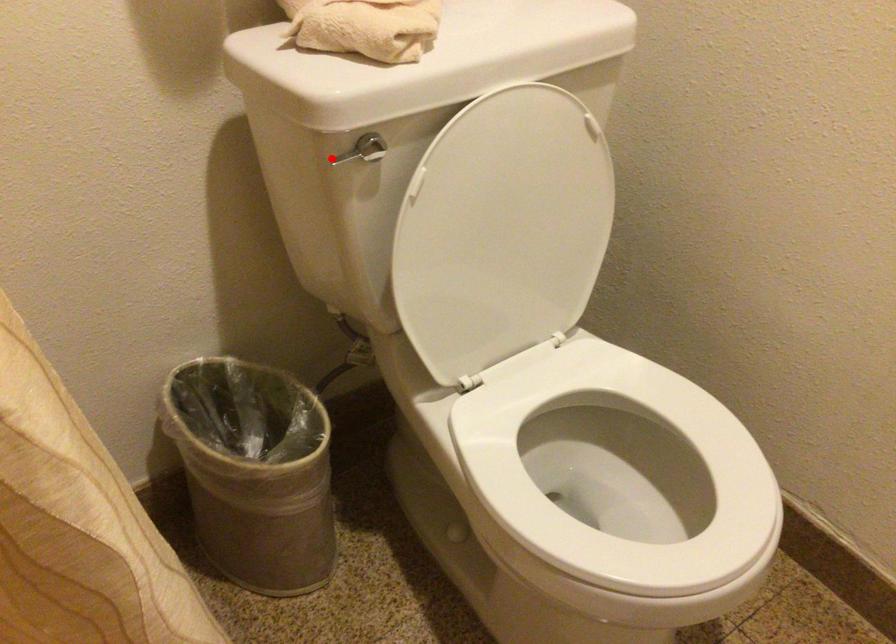
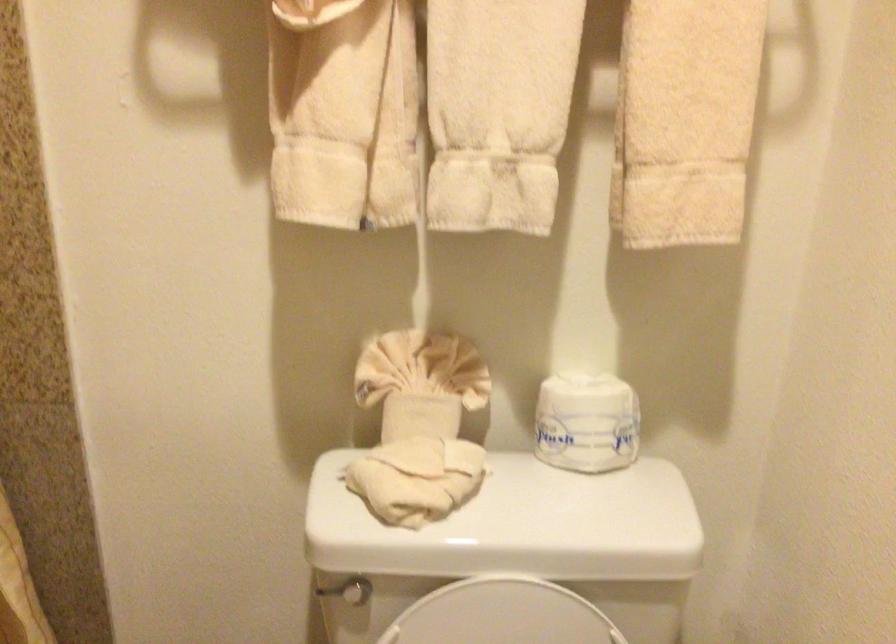
Question: A red point is marked in image1. In image2, is the corresponding 3D point closer to the camera or farther? Reply with the corresponding letter.

Choices:
 (A) The corresponding 3D point is closer.
 (B) The corresponding 3D point is farther.

Answer: (B)